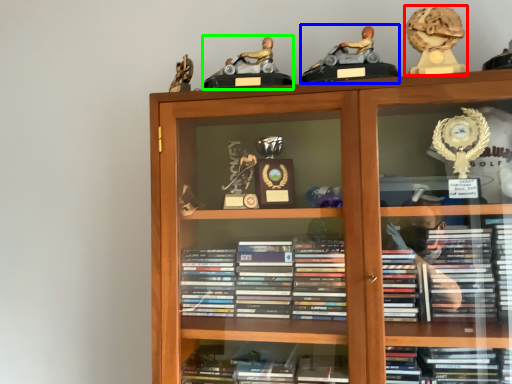
Question: Which object is the closest to the toy (highlighted by a red box)? Choose among these: toy (highlighted by a blue box) or toy (highlighted by a green box).

Choices:
 (A) toy
 (B) toy

Answer: (A)